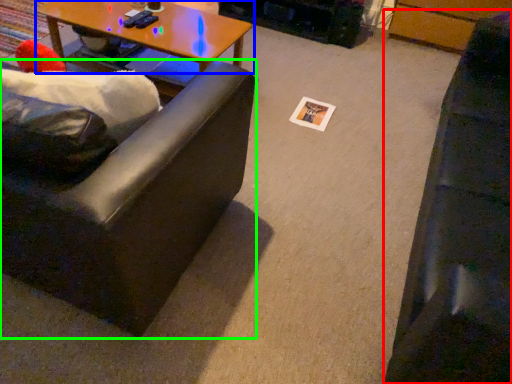
Question: Which is farther away from studio couch (highlighted by a red box)? coffee table (highlighted by a blue box) or studio couch (highlighted by a green box)?

Choices:
 (A) coffee table
 (B) studio couch

Answer: (A)